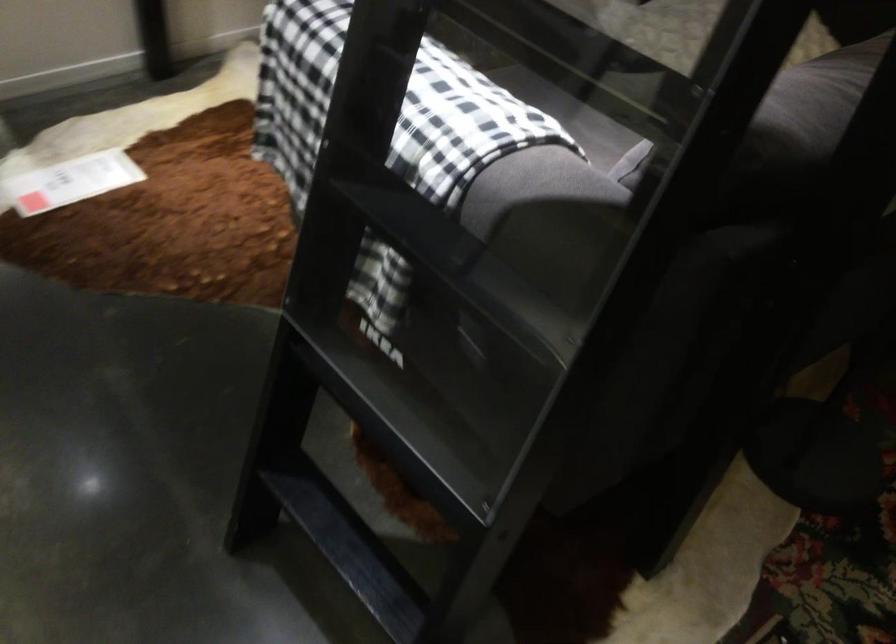
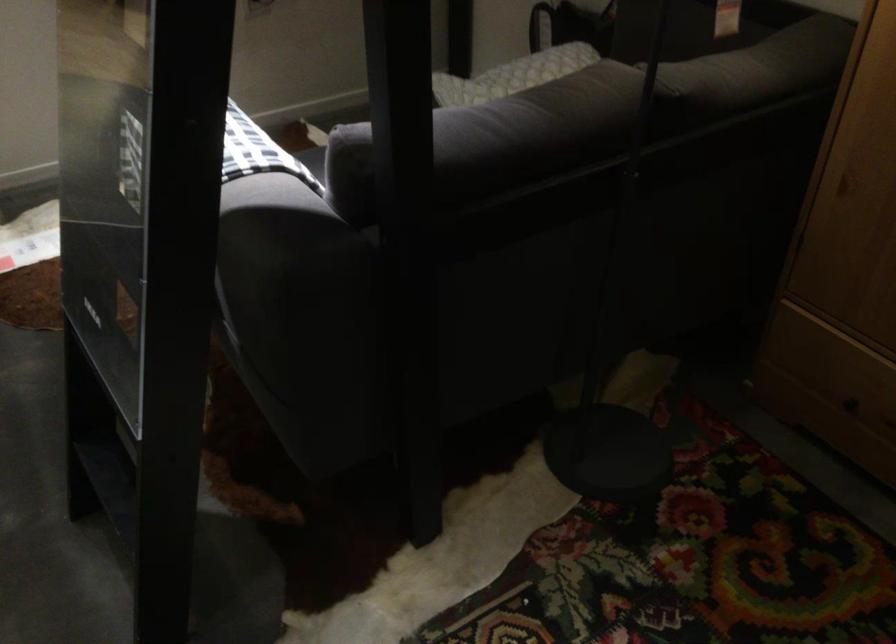
Locate, in the second image, the point that corresponds to (709,184) in the first image.

(208, 163)